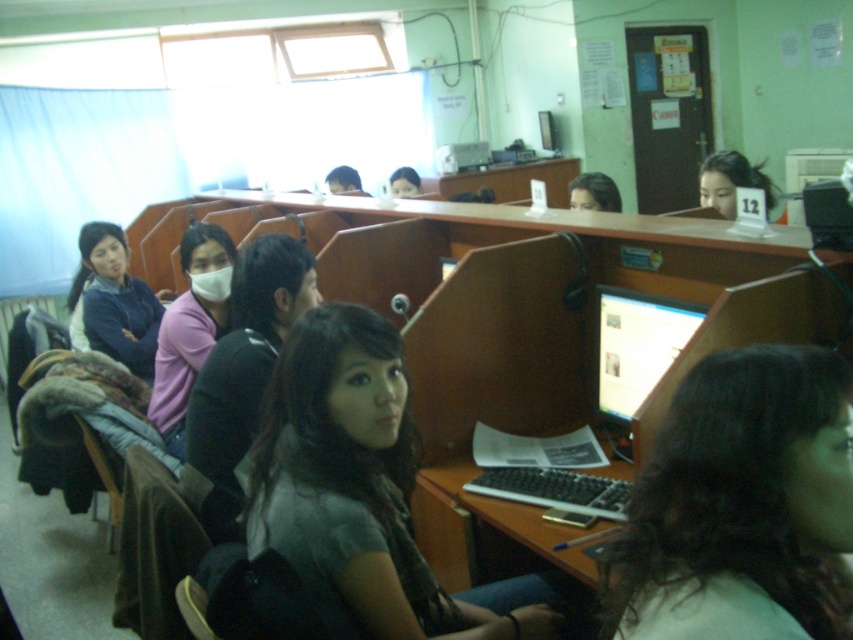
You are a student in the computer lab and you need to place your laptop on the desk. The dark gray fabric at center is in the way. Where should you move it to make space for your laptop?

You should move the dark gray fabric at center to a different location on the desk to create space for your laptop.

Looking at this image, you are a photographer taking a picture of the computer lab. You notice the pink matte shirt at center and the matte black hair at upper center in your frame. Which object should you focus on to ensure it appears larger in the final photo?

The pink matte shirt at center is bigger than the matte black hair at upper center, so you should focus on the pink matte shirt at center to ensure it appears larger in the final photo.